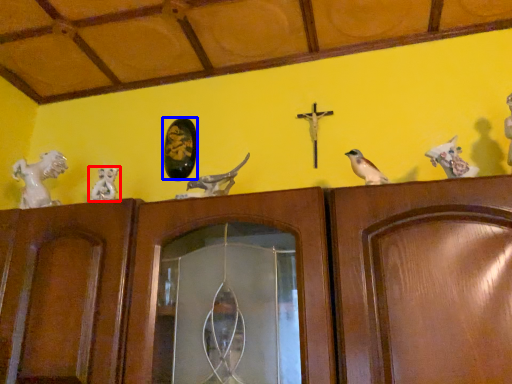
Question: Which object is closer to the camera taking this photo, animal (highlighted by a red box) or art (highlighted by a blue box)?

Choices:
 (A) animal
 (B) art

Answer: (A)